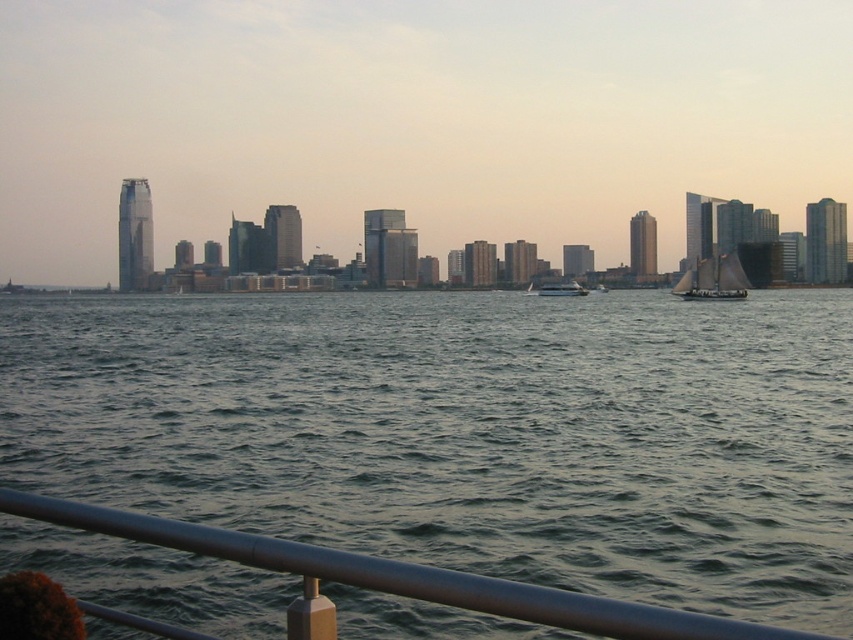
Question: Which point is closer to the camera?

Choices:
 (A) metallic silver rail at lower center
 (B) greenish-gray water at center
 (C) white sailboat at right

Answer: (A)

Question: Which of these objects is positioned farthest from the metallic silver rail at lower center?

Choices:
 (A) white sailboat at right
 (B) white glossy boat at center

Answer: (B)

Question: Is metallic silver rail at lower center thinner than white sailboat at right?

Choices:
 (A) no
 (B) yes

Answer: (B)

Question: Among these points, which one is farthest from the camera?

Choices:
 (A) [722, 632]
 (B) [556, 285]
 (C) [137, 360]
 (D) [682, 282]

Answer: (B)

Question: Does white sailboat at right appear under white glossy boat at center?

Choices:
 (A) yes
 (B) no

Answer: (A)

Question: Is greenish-gray water at center in front of white sailboat at right?

Choices:
 (A) yes
 (B) no

Answer: (A)